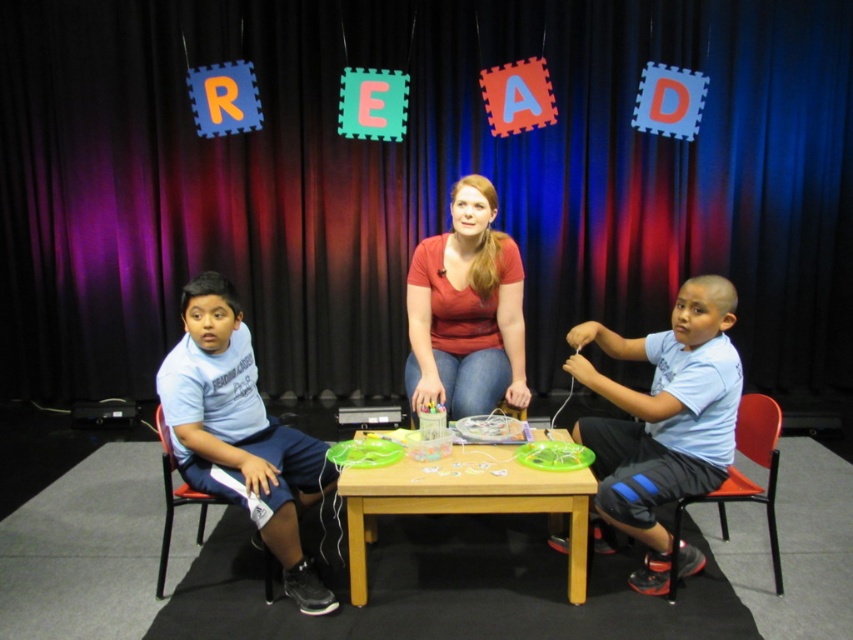
Question: Does matte red shirt at center have a greater width compared to orange plastic chair at right?

Choices:
 (A) no
 (B) yes

Answer: (A)

Question: Does matte red shirt at center have a greater width compared to black plastic chair at left?

Choices:
 (A) no
 (B) yes

Answer: (A)

Question: Considering the real-world distances, which object is closest to the light blue t-shirt at left?

Choices:
 (A) matte black curtain at center
 (B) orange plastic chair at right
 (C) black plastic chair at left
 (D) wooden table at center

Answer: (C)

Question: Is matte black curtain at center closer to camera compared to light blue t-shirt at left?

Choices:
 (A) no
 (B) yes

Answer: (A)

Question: Which of the following is the farthest from the observer?

Choices:
 (A) (253, 497)
 (B) (450, 296)
 (C) (680, 348)
 (D) (404, 252)

Answer: (D)

Question: Among these points, which one is nearest to the camera?

Choices:
 (A) (263, 576)
 (B) (486, 412)
 (C) (248, 448)
 (D) (405, 488)

Answer: (D)